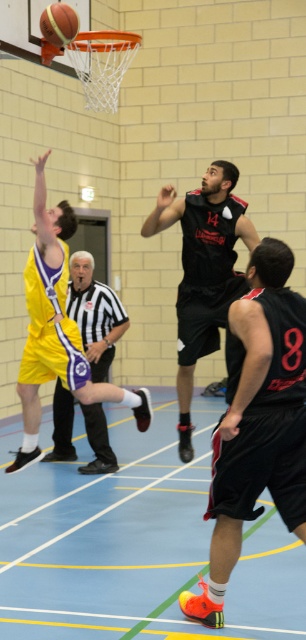
Question: Can you confirm if matte black jersey at upper center is thinner than black and white striped shirt at center?

Choices:
 (A) yes
 (B) no

Answer: (B)

Question: Which point is closer to the camera?

Choices:
 (A) black matte jersey at center
 (B) yellow jersey at left
 (C) matte black jersey at upper center
 (D) black and white striped shirt at center

Answer: (C)

Question: Considering the real-world distances, which object is closest to the black matte jersey at center?

Choices:
 (A) black and white striped shirt at center
 (B) yellow jersey at left

Answer: (B)

Question: Is black matte shorts at center bigger than rubber textured basketball at center?

Choices:
 (A) yes
 (B) no

Answer: (A)

Question: Can you confirm if black matte shorts at center is positioned below rubber textured basketball at center?

Choices:
 (A) yes
 (B) no

Answer: (A)

Question: Which point is farther from the camera taking this photo?

Choices:
 (A) (100, 289)
 (B) (52, 314)

Answer: (A)